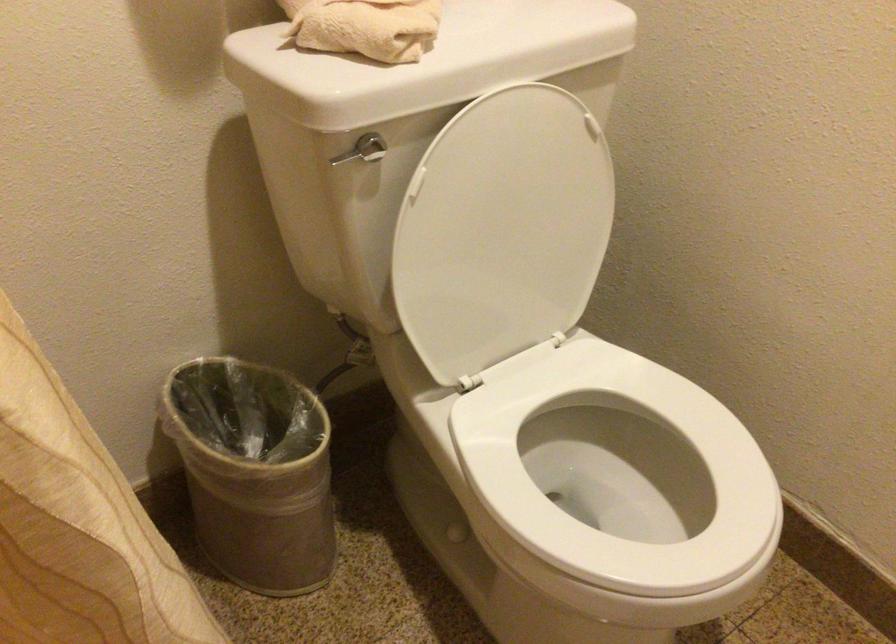
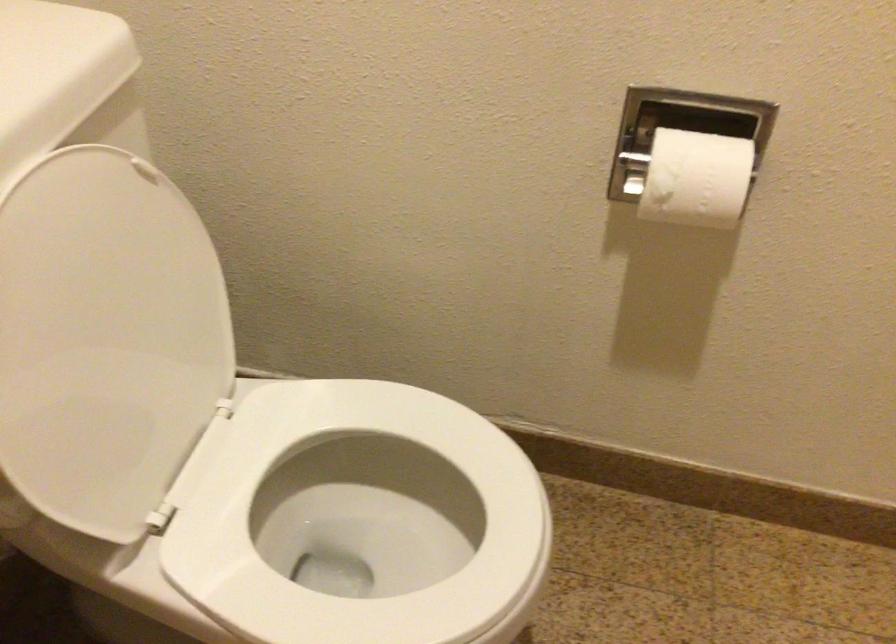
Locate, in the second image, the point that corresponds to (496,229) in the first image.

(105, 339)